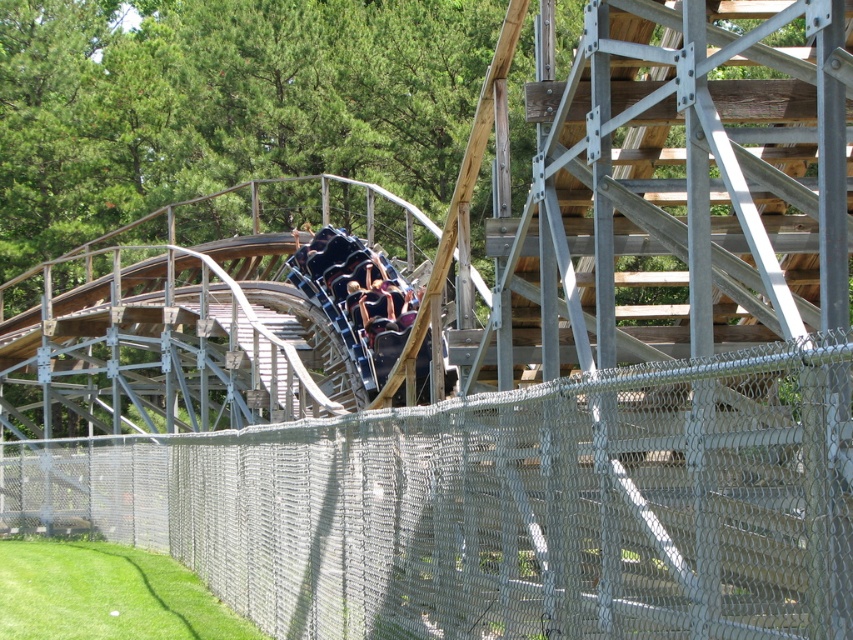
You are a safety inspector checking the roller coaster track. You need to determine if the two points on the track, point (155, 474) and point (444, 381), are positioned in a way that ensures proper alignment for the coaster cars. Based on their spatial relationship, which point is located behind the other?

Point (155, 474) is behind point (444, 381), so it is positioned correctly to ensure proper alignment for the coaster cars.